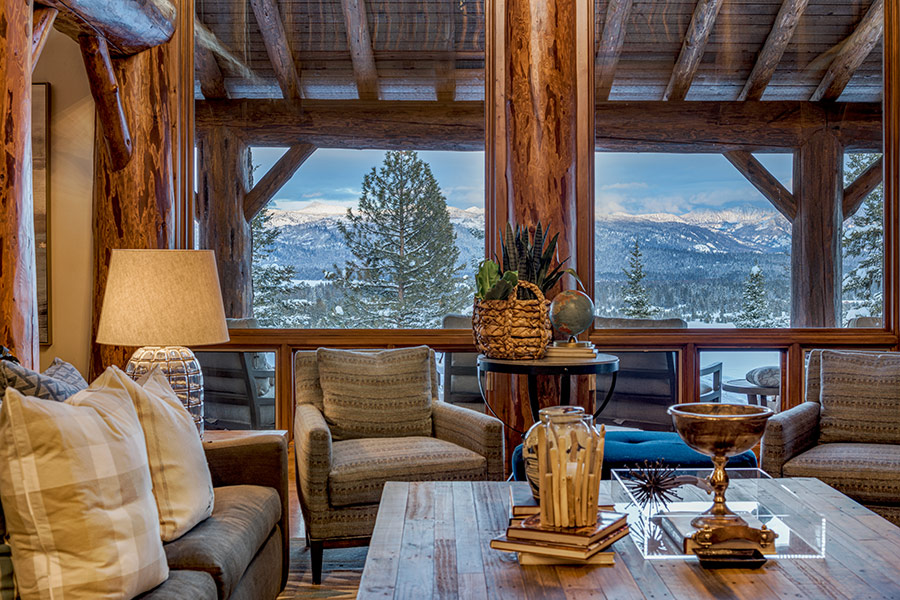
Locate an element on the screen. The width and height of the screenshot is (900, 600). dark brown chair leg is located at coordinates (313, 559).